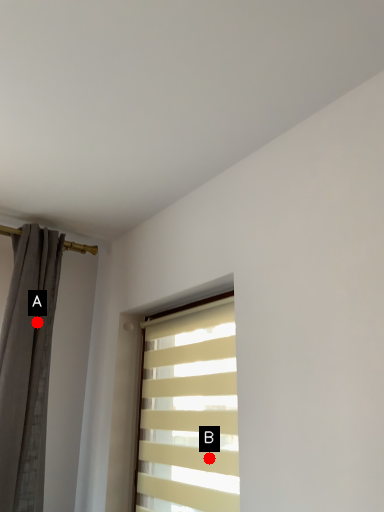
Question: Two points are circled on the image, labeled by A and B beside each circle. Which point is closer to the camera?

Choices:
 (A) A is closer
 (B) B is closer

Answer: (B)